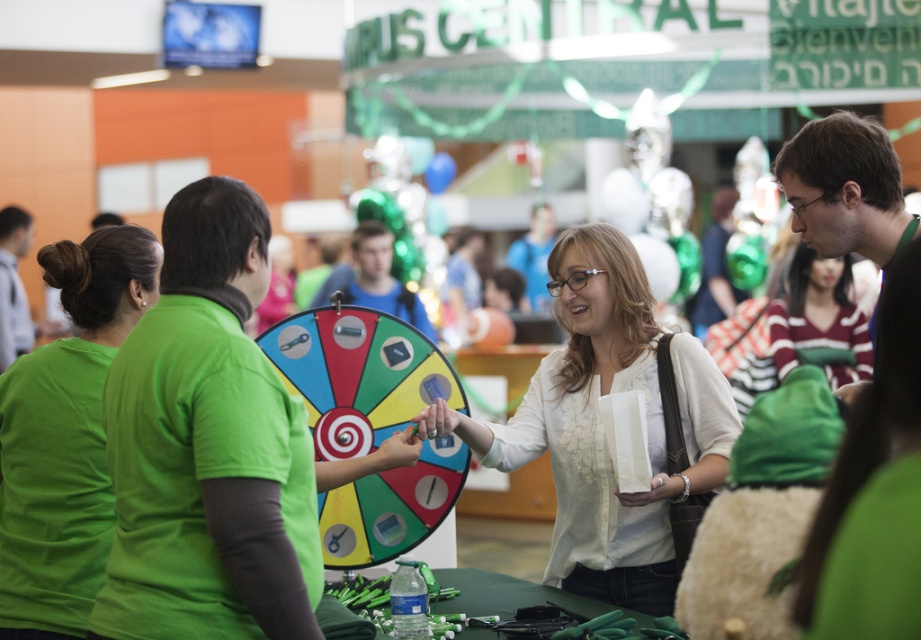
You are standing at the entrance of the hall and want to reach the spinning wheel game located at point (301, 493). If your maximum comfortable walking distance is 5 meters, can you comfortably reach it without straining?

The distance of point (301, 493) from the camera is 5.26 meters. Since your maximum comfortable walking distance is 5 meters, you would need to walk an extra 0.26 meters beyond your comfort zone to reach the spinning wheel game.

You are organizing a photo shoot and need to ensure that the green matte shirt at upper left and the striped knit sweater at center are visible in the frame. Given their widths, which one might require more space horizontally to be fully captured?

The striped knit sweater at center requires more horizontal space because it has a greater width than the green matte shirt at upper left.

You are at an event and see two shirts displayed at the center of the table. The green matte shirt at center and the matte black shirt at center. Which shirt is taller?

The green matte shirt at center is taller than the matte black shirt at center.